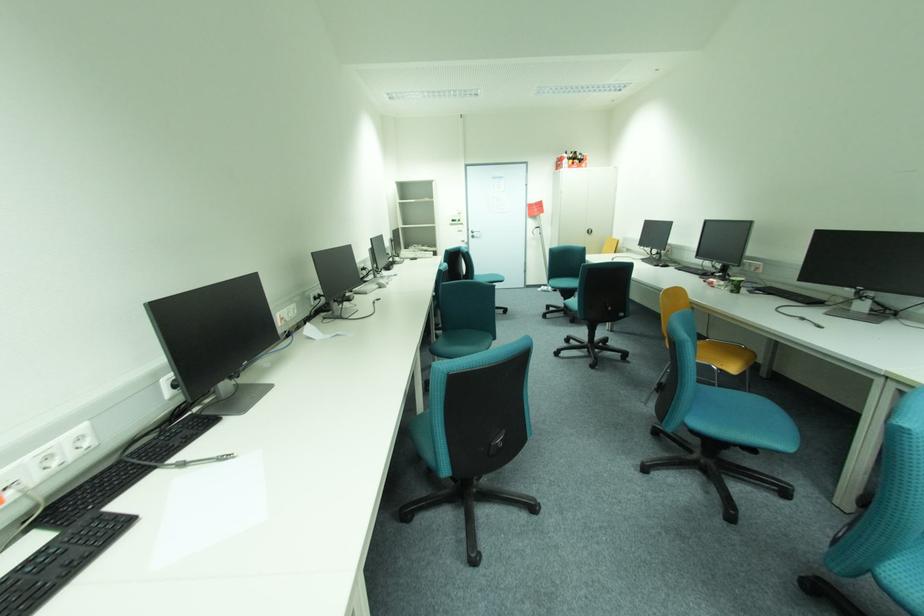
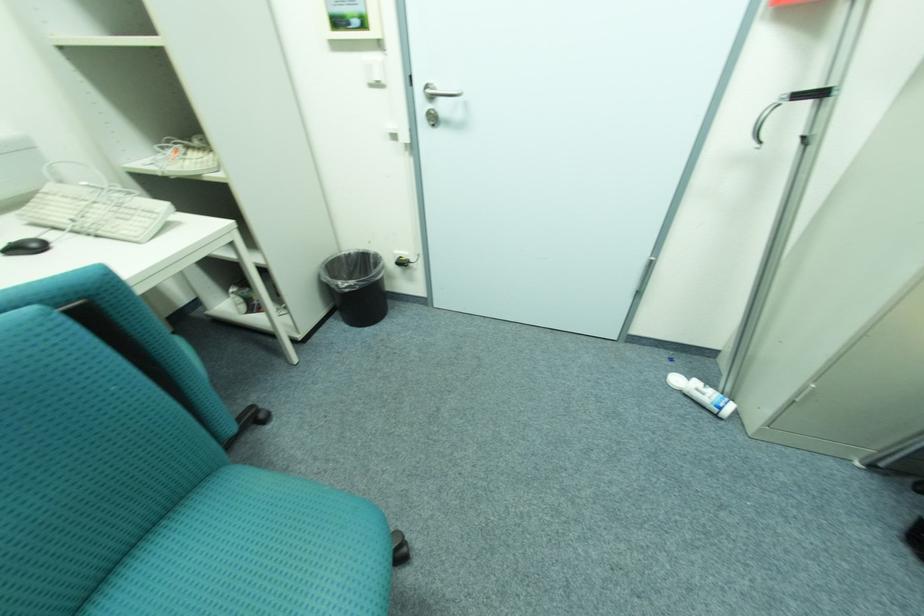
Find the pixel in the second image that matches (545,290) in the first image.

(683, 381)